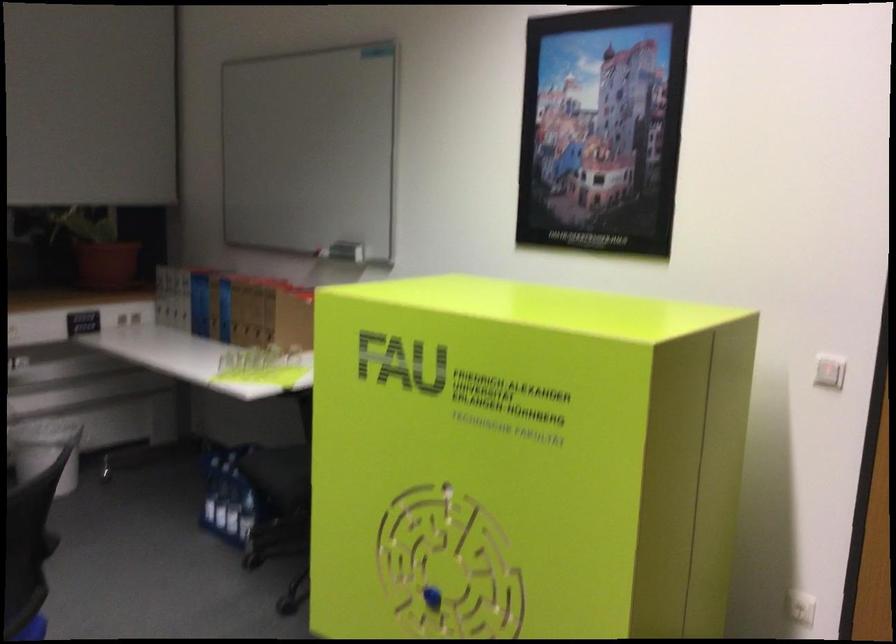
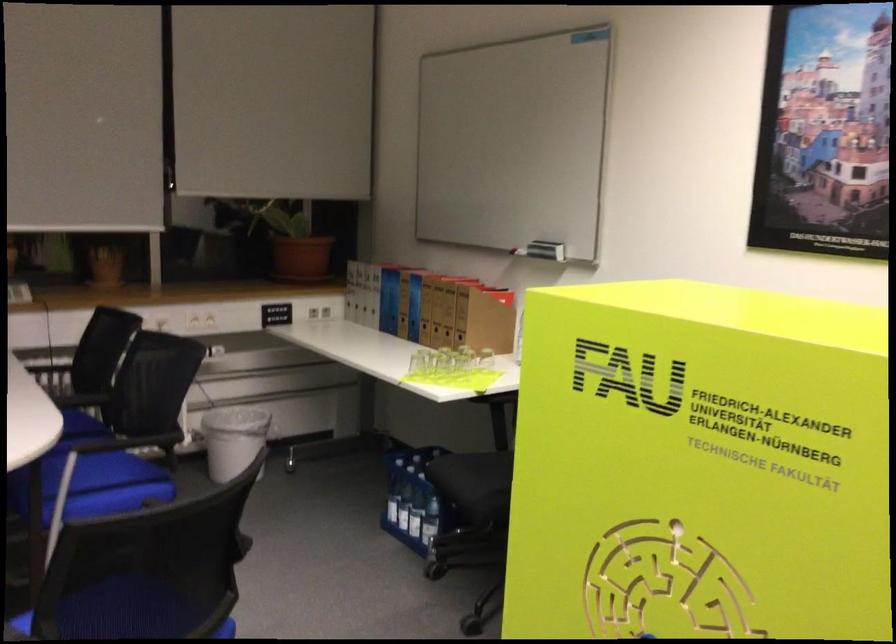
Find the pixel in the second image that matches pixel 211 322 in the first image.

(398, 317)